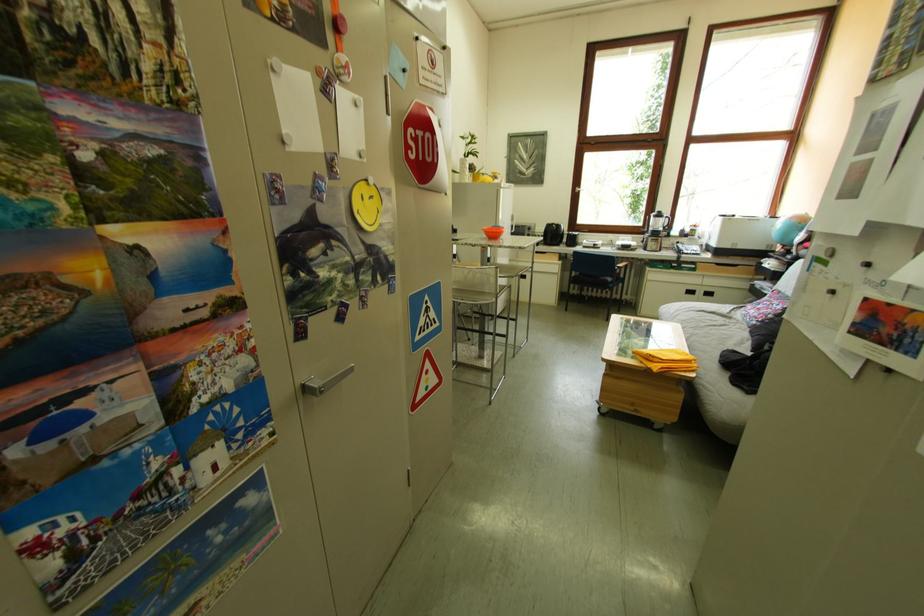
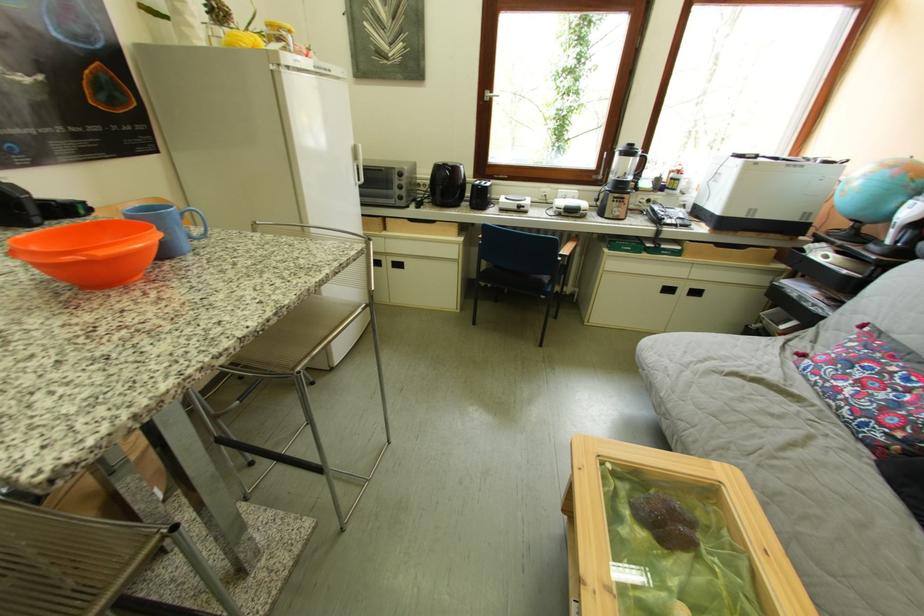
What movement of the cameraman would produce the second image?

The cameraman walked toward right, forward.